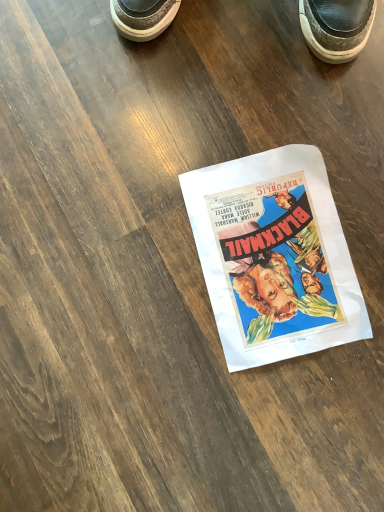
Image resolution: width=384 pixels, height=512 pixels. I want to click on free space above matte paper poster at center (from a real-world perspective), so click(x=279, y=251).